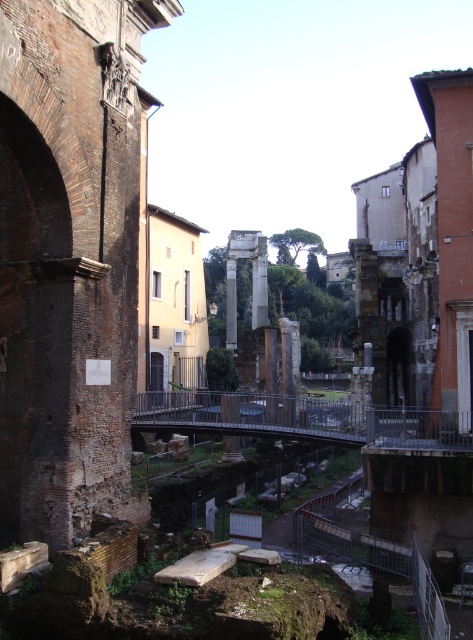
Question: Is brick wall at left above white marble pillar at center?

Choices:
 (A) no
 (B) yes

Answer: (A)

Question: Can you confirm if brick wall at left is positioned to the left of white marble pillar at center?

Choices:
 (A) no
 (B) yes

Answer: (B)

Question: Which point appears farthest from the camera in this image?

Choices:
 (A) (80, 401)
 (B) (236, 326)

Answer: (B)

Question: Which of the following is the farthest from the observer?

Choices:
 (A) white marble pillar at center
 (B) brick wall at left

Answer: (A)

Question: Which of the following is the closest to the observer?

Choices:
 (A) (231, 326)
 (B) (28, 35)

Answer: (B)

Question: Can you confirm if brick wall at left is positioned to the right of white marble pillar at center?

Choices:
 (A) no
 (B) yes

Answer: (A)